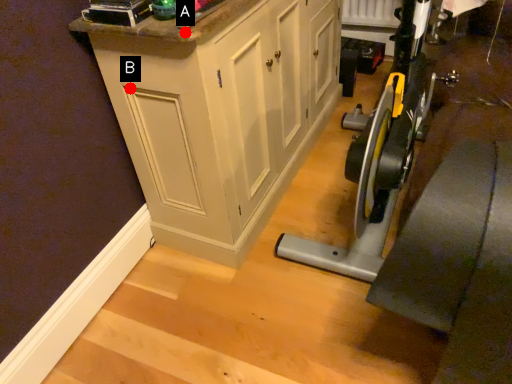
Question: Two points are circled on the image, labeled by A and B beside each circle. Which point is closer to the camera taking this photo?

Choices:
 (A) A is closer
 (B) B is closer

Answer: (A)